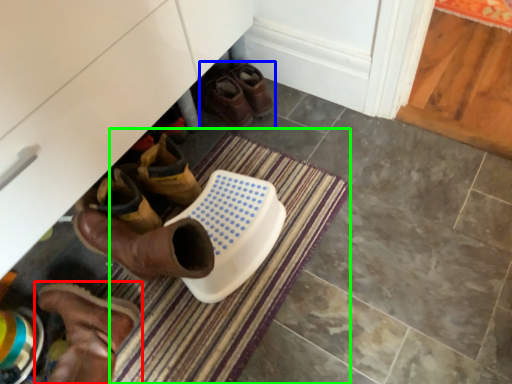
Question: Which object is positioned closest to footwear (highlighted by a red box)? Select from footwear (highlighted by a blue box) and bath mat (highlighted by a green box).

Choices:
 (A) footwear
 (B) bath mat

Answer: (B)